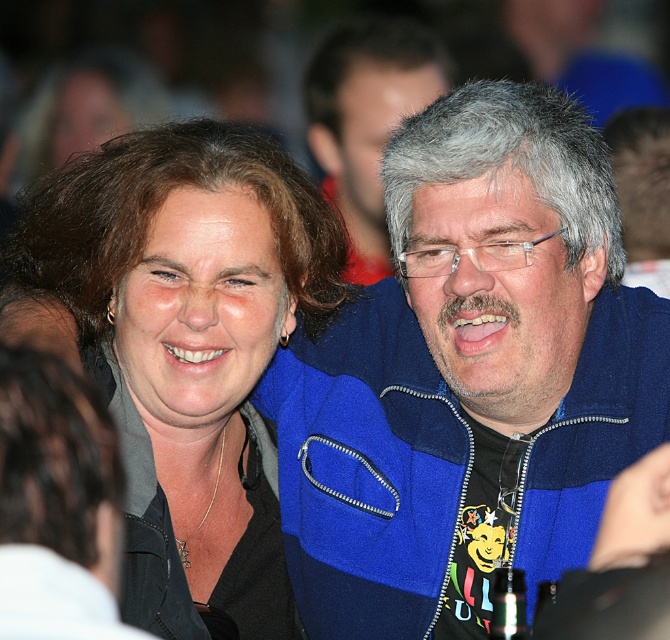
Who is positioned more to the left, matte black jacket at center or blue fleece jacket at upper center?

matte black jacket at center

Is matte black jacket at center thinner than blue fleece jacket at upper center?

No.

Describe the element at coordinates (188, 348) in the screenshot. I see `matte black jacket at center` at that location.

Image resolution: width=670 pixels, height=640 pixels. Identify the location of matte black jacket at center. (188, 348).

Does blue fleece jacket at center appear on the right side of blue fleece jacket at upper center?

Indeed, blue fleece jacket at center is positioned on the right side of blue fleece jacket at upper center.

Which is above, blue fleece jacket at center or blue fleece jacket at upper center?

blue fleece jacket at upper center is higher up.

The height and width of the screenshot is (640, 670). Find the location of `blue fleece jacket at center`. blue fleece jacket at center is located at coordinates (468, 372).

Who is more forward, (620, 419) or (255, 442)?

Point (620, 419) is more forward.

Consider the image. Who is positioned more to the left, blue fleece jacket at center or matte black jacket at center?

Positioned to the left is matte black jacket at center.

Locate an element on the screen. blue fleece jacket at center is located at coordinates (468, 372).

Identify the location of blue fleece jacket at center. (468, 372).